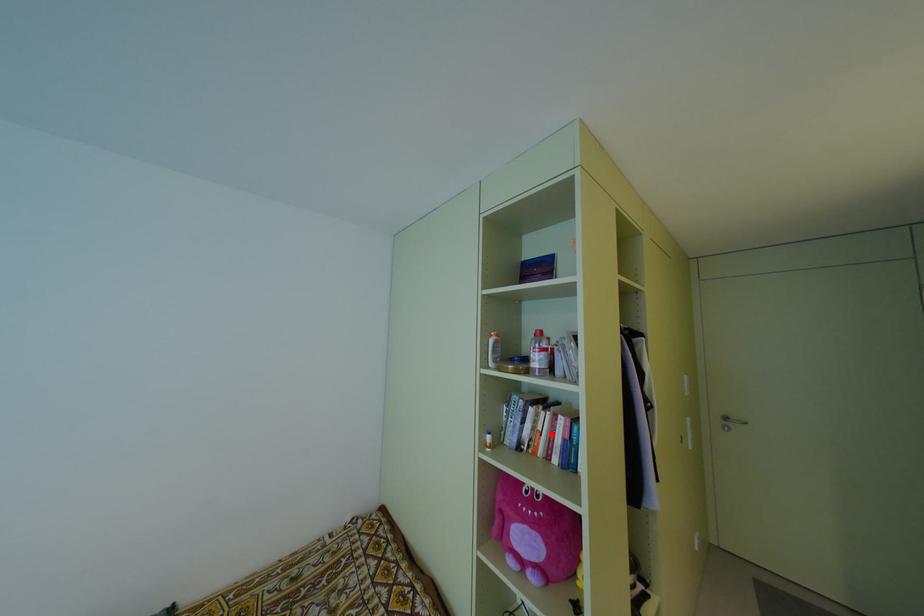
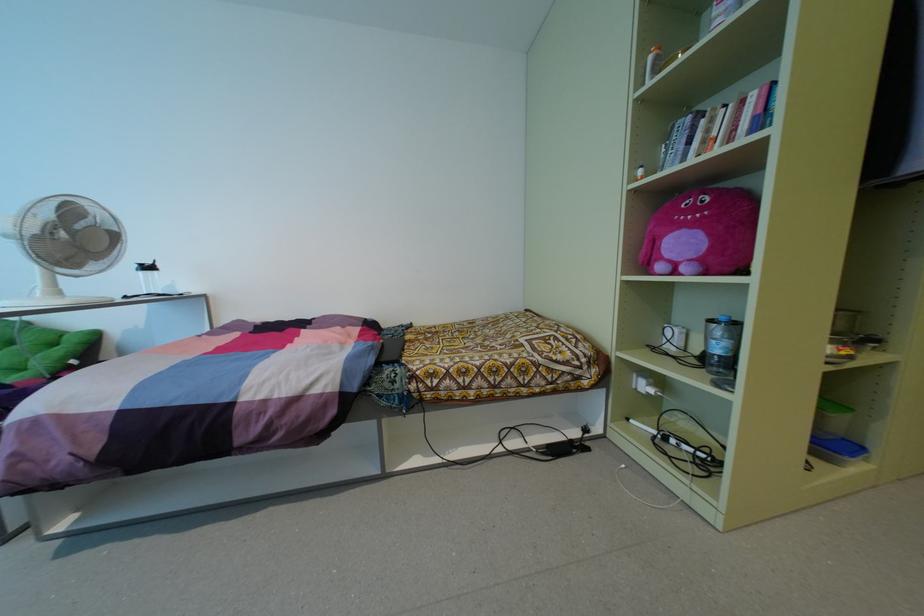
Where in the second image is the point corresponding to the highlighted location from the first image?

(734, 129)